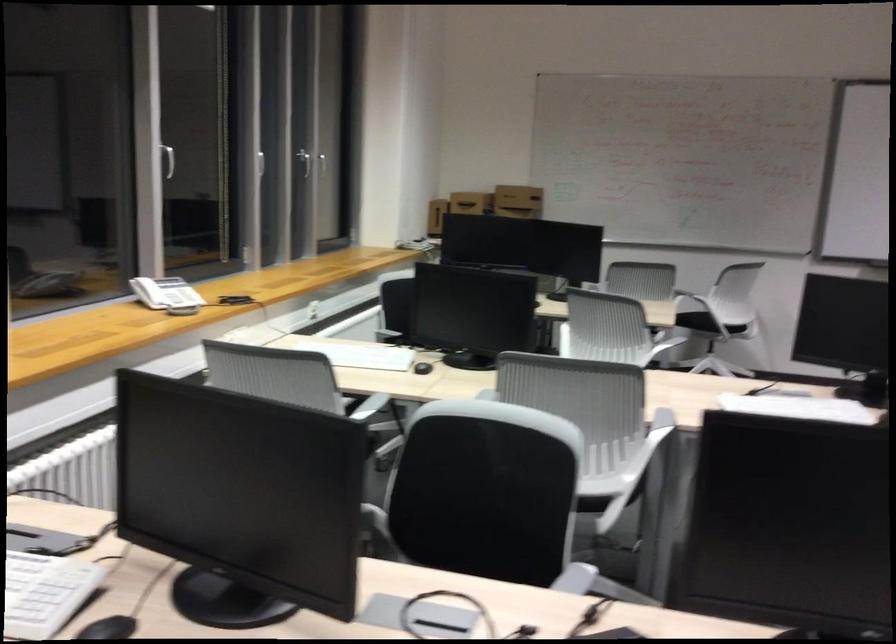
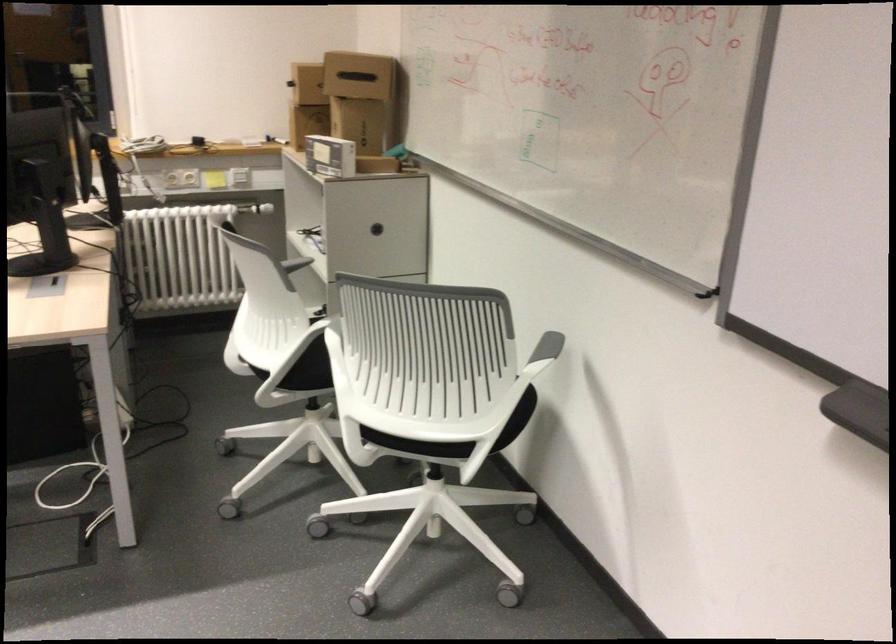
Question: I am providing you with two images of the same scene from different viewpoints. Please identify which objects are invisible in image2.

Choices:
 (A) gray chair armrest
 (B) whiteboard marker tray
 (C) round cabinet handle
 (D) none of these

Answer: (D)